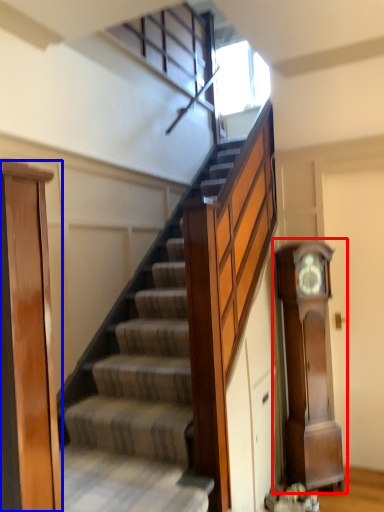
Question: Which object appears closest to the camera in this image, clock (highlighted by a red box) or door (highlighted by a blue box)?

Choices:
 (A) clock
 (B) door

Answer: (B)